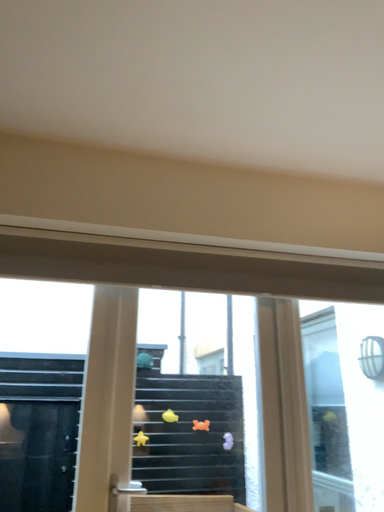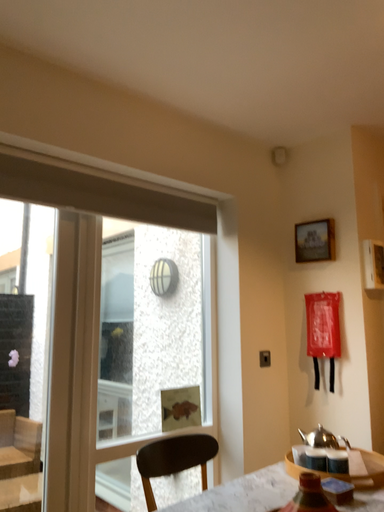
Question: Which way did the camera rotate in the video?

Choices:
 (A) rotated right
 (B) rotated left

Answer: (A)